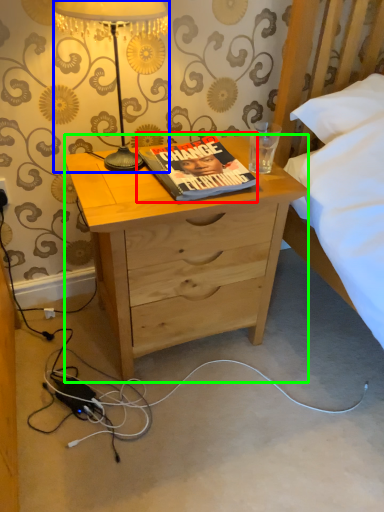
Question: Based on their relative distances, which object is farther from book (highlighted by a red box)? Choose from lamp (highlighted by a blue box) and desk (highlighted by a green box).

Choices:
 (A) lamp
 (B) desk

Answer: (A)